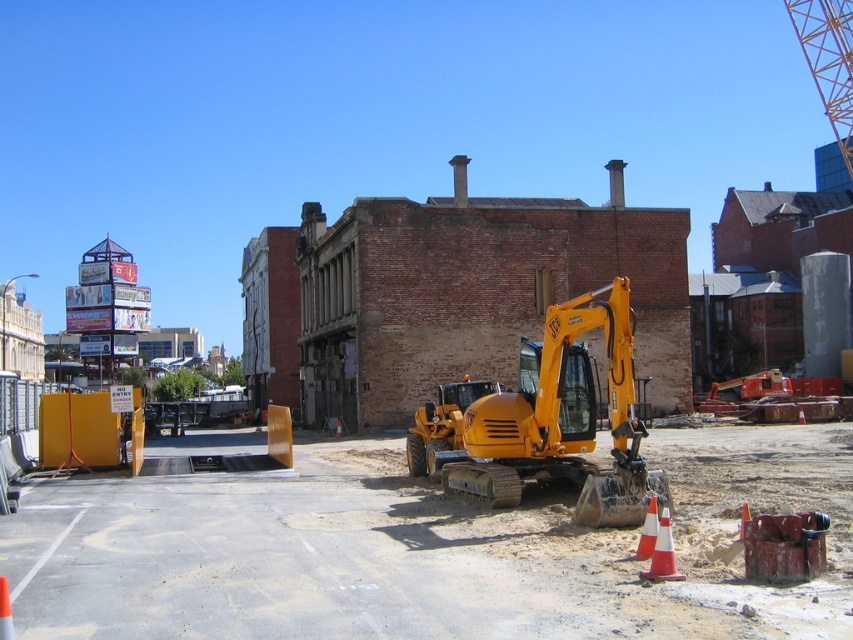
Question: Which object is the farthest from the orange plastic cone at lower right?

Choices:
 (A) orange reflective cone at lower right
 (B) orange traffic cone at lower left
 (C) yellow rubber excavator at center
 (D) orange traffic cone at center

Answer: (D)

Question: Which is nearer to the yellow metallic crane at upper right?

Choices:
 (A) orange traffic cone at center
 (B) yellow rubber excavator at center
 (C) orange plastic cone at lower right

Answer: (B)

Question: Considering the relative positions of yellow rubber excavator at center and yellow metallic crane at upper right in the image provided, where is yellow rubber excavator at center located with respect to yellow metallic crane at upper right?

Choices:
 (A) above
 (B) below

Answer: (B)

Question: Does orange plastic cone at lower right appear on the left side of orange reflective cone at lower right?

Choices:
 (A) yes
 (B) no

Answer: (A)

Question: Does yellow rubber excavator at center appear on the right side of yellow metallic crane at upper right?

Choices:
 (A) no
 (B) yes

Answer: (A)

Question: Which object appears farthest from the camera in this image?

Choices:
 (A) yellow rubber excavator at center
 (B) orange traffic cone at lower left
 (C) orange plastic cone at lower right
 (D) orange traffic cone at center

Answer: (D)